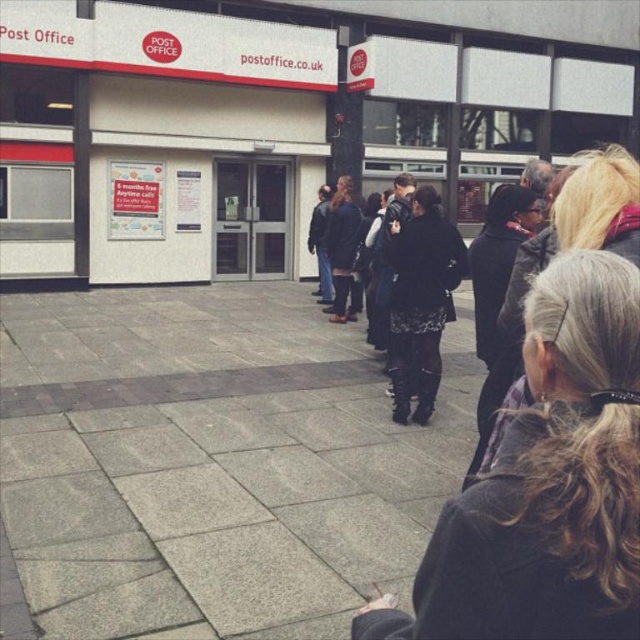
Question: Is black leather jacket at right thinner than black textured coat at center?

Choices:
 (A) no
 (B) yes

Answer: (B)

Question: Is black leather jacket at right thinner than black textured coat at center?

Choices:
 (A) yes
 (B) no

Answer: (A)

Question: Is black leather jacket at right above black textured coat at center?

Choices:
 (A) yes
 (B) no

Answer: (B)

Question: Which object appears closest to the camera in this image?

Choices:
 (A) black leather jacket at right
 (B) black textured coat at center

Answer: (A)